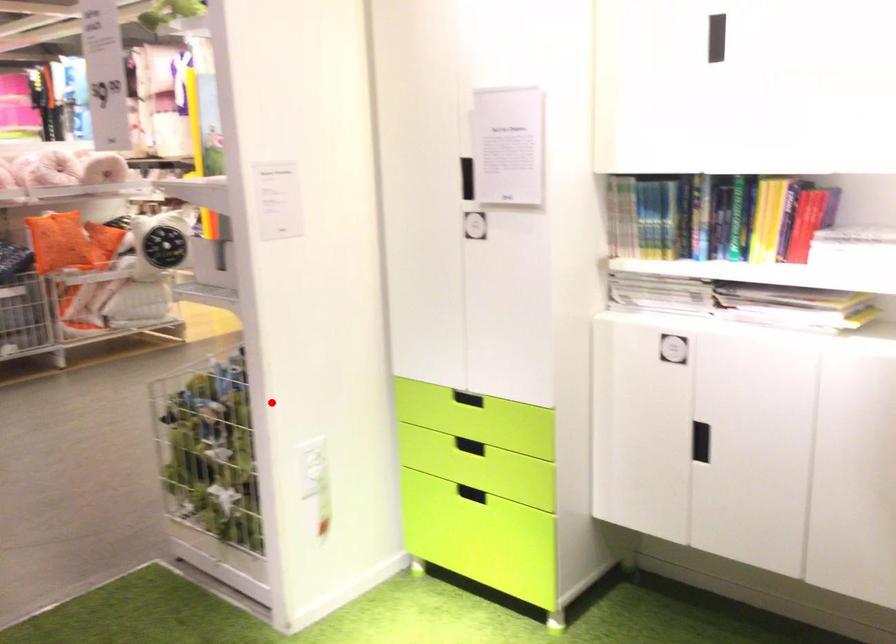
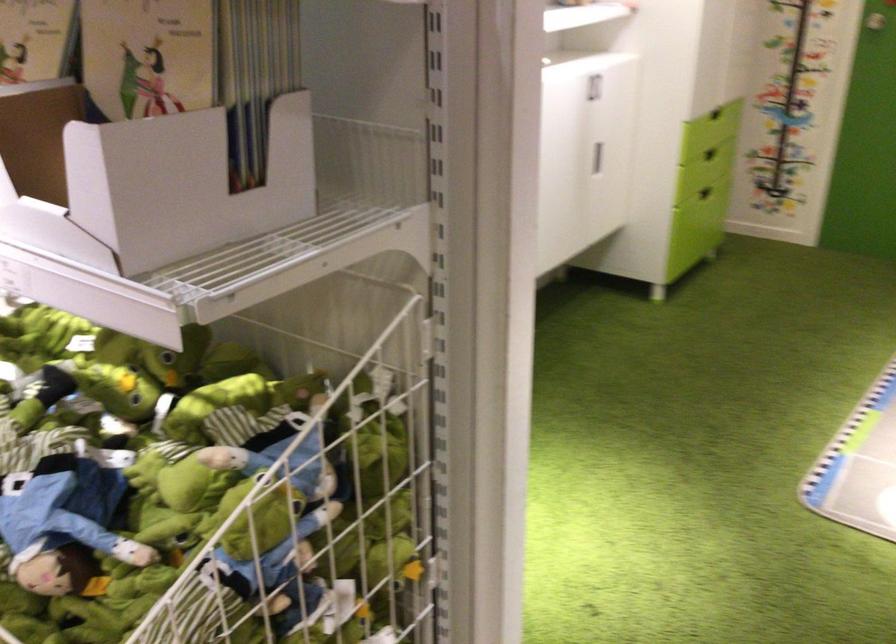
Question: I am providing you with two images of the same scene from different viewpoints. In image1, a red point is highlighted. Considering the same 3D point in image2, which of the following is correct?

Choices:
 (A) It is closer
 (B) It is farther

Answer: (A)